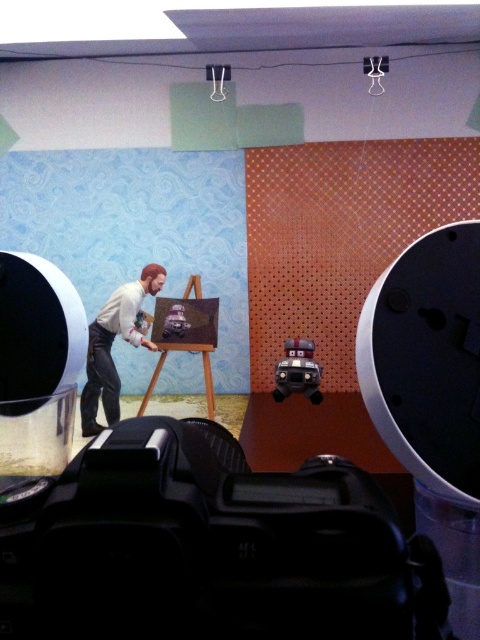
You are standing in front of the camera setup. There are two points marked in the image, one at coordinates point (113, 392) and another at point (200, 339). Which point is closer to the camera?

Point (200, 339) is closer to the camera since it is in front of point (113, 392).

You are a photographer setting up a scene. You have a smooth beige shirt at center and a wooden easel at center in your setup. Which object is closer to the camera?

The smooth beige shirt at center is closer to the camera because it is in front of the wooden easel at center.